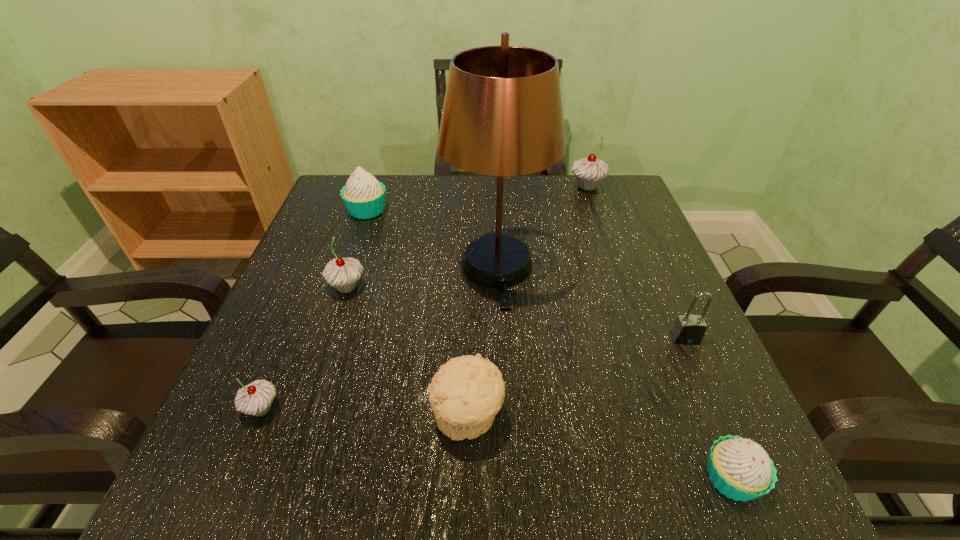
The width and height of the screenshot is (960, 540). I want to click on vacant space at the left edge of the desktop, so click(x=287, y=313).

In order to click on free space at the right edge in this screenshot , I will do 612,312.

In the image, there is a desktop. Where is `vacant space at the far left corner`? The width and height of the screenshot is (960, 540). vacant space at the far left corner is located at coordinates (385, 209).

In the image, there is a desktop. What are the coordinates of `vacant space at the far right corner` in the screenshot? It's located at (583, 208).

The height and width of the screenshot is (540, 960). Find the location of `empty space between the biggest gray cupcake and the tallest object`. empty space between the biggest gray cupcake and the tallest object is located at coordinates (542, 227).

The image size is (960, 540). Find the location of `empty location between the farthest cupcake and the muffin`. empty location between the farthest cupcake and the muffin is located at coordinates (527, 302).

You are a GUI agent. You are given a task and a screenshot of the screen. Output one action in this format:
    pyautogui.click(x=<x>, y=<y>)
    Task: Click on the vacant point located between the nearer white cupcake and the gray padlock
    
    Given the screenshot: What is the action you would take?
    pyautogui.click(x=708, y=408)

Image resolution: width=960 pixels, height=540 pixels. I want to click on vacant area between the gray padlock and the muffin, so click(576, 377).

Locate an element on the screen. This screenshot has width=960, height=540. free space between the second nearest cupcake and the farthest gray cupcake is located at coordinates (424, 298).

Find the location of a particular element. The width and height of the screenshot is (960, 540). free space between the second tallest object and the second gray cupcake from left to right is located at coordinates (467, 237).